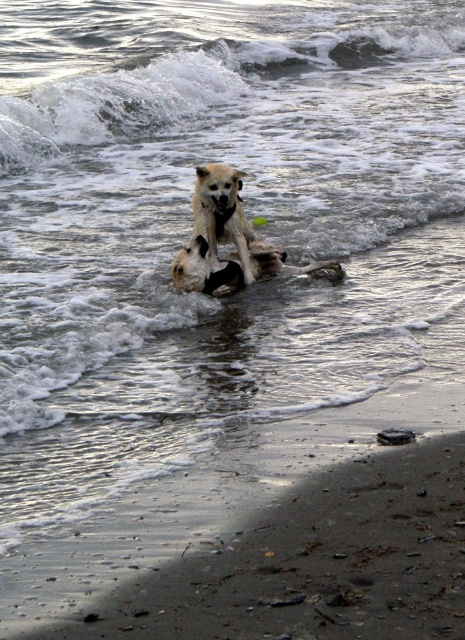
Question: Does white frothy wave at upper center have a smaller size compared to light brown fur dog at center?

Choices:
 (A) no
 (B) yes

Answer: (A)

Question: Is white frothy wave at upper center closer to camera compared to light brown fur dog at center?

Choices:
 (A) yes
 (B) no

Answer: (B)

Question: Can you confirm if white frothy wave at upper center is positioned to the left of light brown fur dog at center?

Choices:
 (A) no
 (B) yes

Answer: (B)